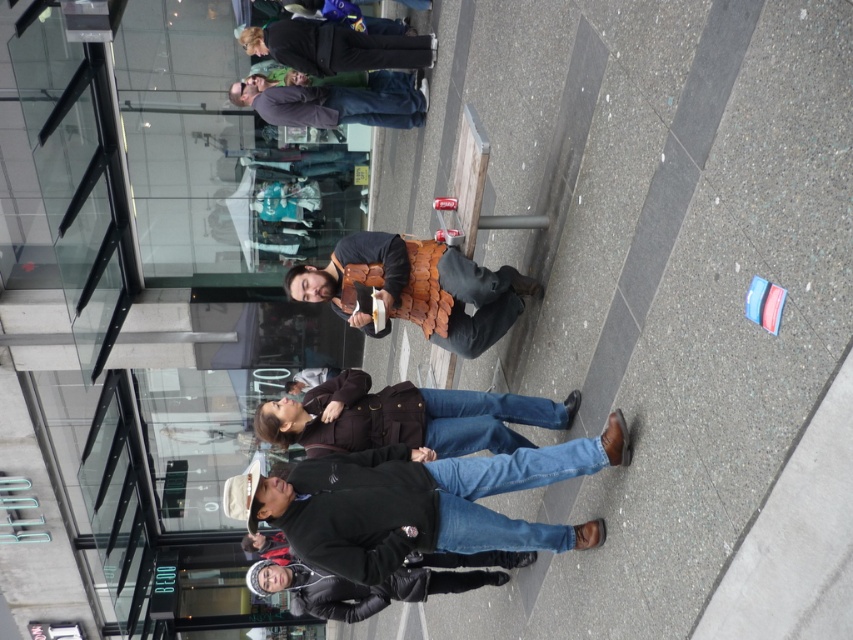
Which of these two, dark brown leather jacket at lower center or black leather pants at upper center, stands taller?

Standing taller between the two is dark brown leather jacket at lower center.

Is dark brown leather jacket at lower center to the right of black leather pants at upper center from the viewer's perspective?

Yes, dark brown leather jacket at lower center is to the right of black leather pants at upper center.

Does point (552, 465) come closer to viewer compared to point (337, 44)?

That is True.

Image resolution: width=853 pixels, height=640 pixels. In order to click on dark brown leather jacket at lower center in this screenshot , I will do `click(424, 502)`.

Which is behind, point (315, 588) or point (264, 38)?

Point (264, 38)

Which of these two, black leather jacket at lower center or black leather pants at upper center, stands taller?

black leather jacket at lower center is taller.

Which is in front, point (294, 602) or point (367, 44)?

Point (294, 602)

I want to click on black leather jacket at lower center, so click(373, 586).

Identify the location of brown leather armor at center. The height and width of the screenshot is (640, 853). (418, 289).

Who is shorter, brown leather armor at center or black leather pants at upper center?

black leather pants at upper center

Where is `brown leather armor at center`? The width and height of the screenshot is (853, 640). brown leather armor at center is located at coordinates (418, 289).